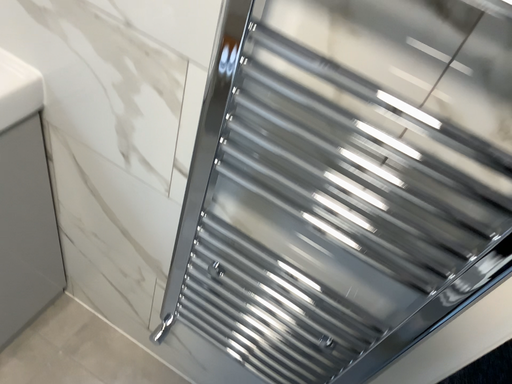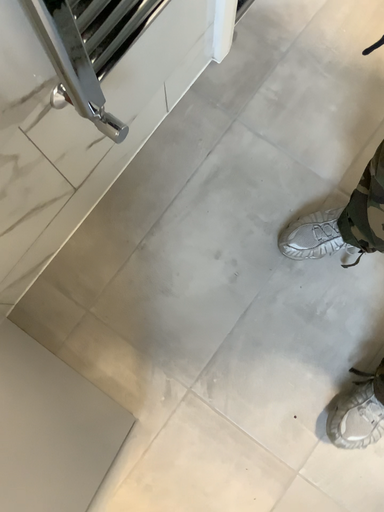
Question: How did the camera likely rotate when shooting the video?

Choices:
 (A) rotated upward
 (B) rotated downward

Answer: (B)